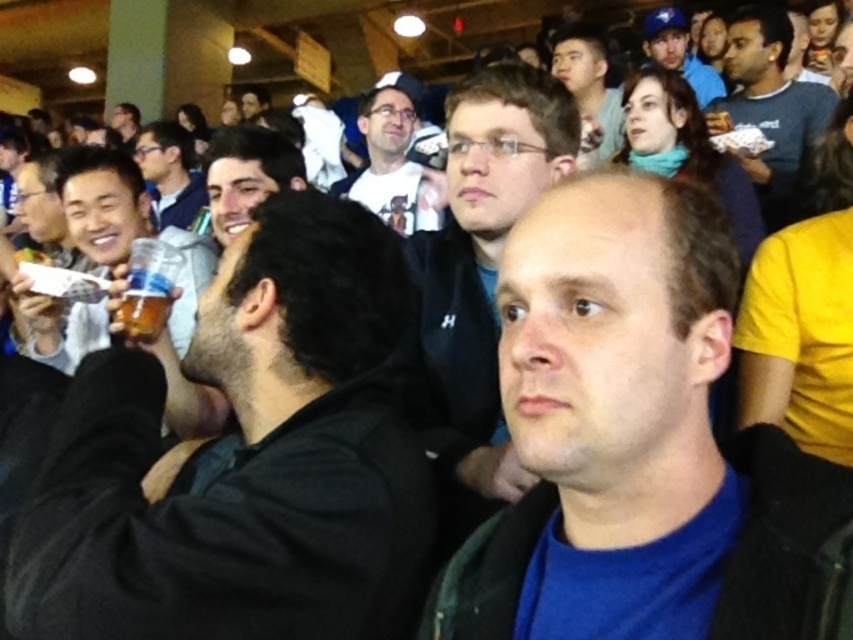
You are at an indoor event and need to locate two people wearing specific clothing. You see the matte black jacket at center and the dark blue shirt at upper right. Which one is positioned lower in the scene?

The matte black jacket at center is positioned lower than the dark blue shirt at upper right.